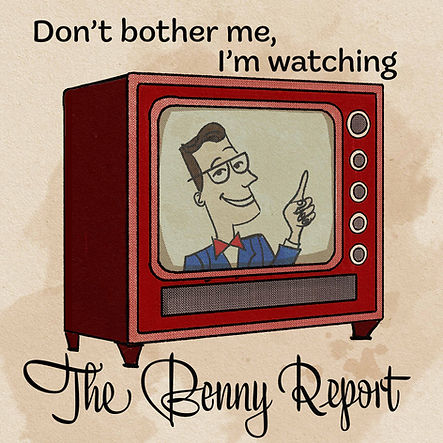
Locate an element on the screen. Image resolution: width=443 pixels, height=443 pixels. tv buttons is located at coordinates (359, 253), (357, 225), (357, 186), (361, 161), (356, 117).